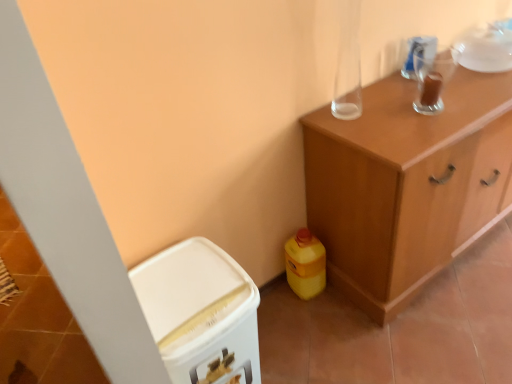
Locate an element on the screen. This screenshot has width=512, height=384. vacant space in front of yellow plastic bottle at lower right is located at coordinates tap(311, 317).